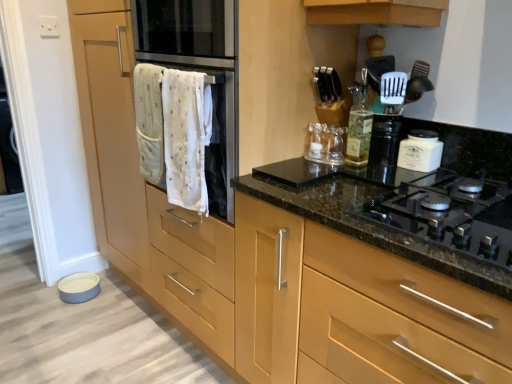
Describe the element at coordinates (355, 309) in the screenshot. I see `matte wood cabinet at center` at that location.

The height and width of the screenshot is (384, 512). Describe the element at coordinates (186, 138) in the screenshot. I see `white cotton bath towel at center, which appears as the 2th bath towel when viewed from the left` at that location.

What is the approximate height of white plastic spatula at upper right?

white plastic spatula at upper right is 7.53 inches in height.

At what (x,y) coordinates should I click in order to perform the action: click on black glass gas stove at center right. Please return your answer as a coordinate pair (x, y). The image size is (512, 384). Looking at the image, I should click on (444, 215).

Locate an element on the screen. oven on the left of translucent glass bottle at upper center is located at coordinates (199, 71).

Considering the positions of point (352, 135) and point (228, 103), is point (352, 135) closer or farther from the camera than point (228, 103)?

Clearly, point (352, 135) is more distant from the camera than point (228, 103).

Consider the image. Which of these two, translucent glass bottle at upper center or white cloth oven at center, is thinner?

With smaller width is translucent glass bottle at upper center.

Is white cloth oven at center at the back of translucent glass bottle at upper center?

translucent glass bottle at upper center does not have its back to white cloth oven at center.

Is white matte jar at upper right oriented away from white plastic spatula at upper right?

That's not correct — white matte jar at upper right is not looking away from white plastic spatula at upper right.

Consider the image. How many degrees apart are the facing directions of white matte jar at upper right and white plastic spatula at upper right?

35.3 degrees.

Considering the relative sizes of white matte jar at upper right and white plastic spatula at upper right in the image provided, is white matte jar at upper right taller than white plastic spatula at upper right?

In fact, white matte jar at upper right may be shorter than white plastic spatula at upper right.

Identify the location of appliance above the white matte jar at upper right (from the image's perspective). (388, 119).

Considering the relative sizes of matte wood cabinet at center and white quilted towel at center, the second bath towel when ordered from right to left, in the image provided, is matte wood cabinet at center wider than white quilted towel at center, the second bath towel when ordered from right to left,?

Indeed, matte wood cabinet at center has a greater width compared to white quilted towel at center, the second bath towel when ordered from right to left.

What's the angular difference between matte wood cabinet at center and white quilted towel at center, which is counted as the first bath towel, starting from the left,'s facing directions?

0.413 degrees.

Looking at this image, considering the relative sizes of matte wood cabinet at center and white quilted towel at center, which is counted as the first bath towel, starting from the left, in the image provided, is matte wood cabinet at center taller than white quilted towel at center, which is counted as the first bath towel, starting from the left,?

Indeed, matte wood cabinet at center has a greater height compared to white quilted towel at center, which is counted as the first bath towel, starting from the left.

Is matte wood cabinet at center oriented towards white quilted towel at center, which is counted as the first bath towel, starting from the left?

No, matte wood cabinet at center is not oriented towards white quilted towel at center, which is counted as the first bath towel, starting from the left.

Is white plastic spatula at upper right taller or shorter than matte wood cabinet at center?

Considering their sizes, white plastic spatula at upper right has less height than matte wood cabinet at center.

Visually, is white plastic spatula at upper right positioned to the left or to the right of matte wood cabinet at center?

In the image, white plastic spatula at upper right appears on the right side of matte wood cabinet at center.

From the picture: From a real-world perspective, who is located higher, white plastic spatula at upper right or matte wood cabinet at center?

white plastic spatula at upper right.

Would you say matte wood cabinet at center is part of white matte jar at upper right's contents?

Definitely not — matte wood cabinet at center is not inside white matte jar at upper right.

Is white matte jar at upper right far away from matte wood cabinet at center?

No, white matte jar at upper right is in close proximity to matte wood cabinet at center.

Which of these two, white matte jar at upper right or matte wood cabinet at center, is wider?

With larger width is matte wood cabinet at center.

Is white matte jar at upper right bigger or smaller than matte wood cabinet at center?

Considering their sizes, white matte jar at upper right takes up less space than matte wood cabinet at center.

From the picture: From the image's perspective, relative to translucent glass bottle at upper center, is white cloth oven at center above or below?

Clearly, from the image's perspective, white cloth oven at center is above translucent glass bottle at upper center.

Is white cloth oven at center spatially inside translucent glass bottle at upper center, or outside of it?

white cloth oven at center is not inside translucent glass bottle at upper center, it's outside.

Is white cloth oven at center turned away from translucent glass bottle at upper center?

No, white cloth oven at center's orientation is not away from translucent glass bottle at upper center.

Does point (337, 303) come closer to viewer compared to point (169, 182)?

Yes, it is.

Is the depth of matte wood cabinet at center greater than that of white cotton bath towel at center, which appears as the 2th bath towel when viewed from the left?

No.

Can you confirm if matte wood cabinet at center is bigger than white cotton bath towel at center, the 1th bath towel when ordered from right to left?

Yes.

Locate an element on the screen. bottle that appears behind the white cloth oven at center is located at coordinates (358, 127).

The height and width of the screenshot is (384, 512). What are the coordinates of `appliance to the left of white matte jar at upper right` in the screenshot? It's located at (388, 119).

Looking at the image, which one is located closer to black glass gas stove at center right, matte wood cabinet at center or white quilted towel at center, which is counted as the first bath towel, starting from the left?

Based on the image, matte wood cabinet at center appears to be nearer to black glass gas stove at center right.

Looking at the image, which one is located closer to translucent glass bottle at upper center, white cotton bath towel at center, which appears as the 2th bath towel when viewed from the left, or white cloth oven at center?

Based on the image, white cloth oven at center appears to be nearer to translucent glass bottle at upper center.

When comparing their distances from black glass gas stove at center right, does white cloth oven at center or matte wood cabinet at center seem closer?

matte wood cabinet at center is closer to black glass gas stove at center right.

Considering their positions, is black glass gas stove at center right positioned closer to white cloth oven at center than white matte jar at upper right?

Based on the image, black glass gas stove at center right appears to be nearer to white cloth oven at center.

Looking at the image, which one is located further to white matte jar at upper right, white cloth oven at center or translucent glass bottle at upper center?

white cloth oven at center is further to white matte jar at upper right.

Which object lies nearer to the anchor point white matte jar at upper right, white cotton bath towel at center, the 1th bath towel when ordered from right to left, or white quilted towel at center, which is counted as the first bath towel, starting from the left?

The object closer to white matte jar at upper right is white cotton bath towel at center, the 1th bath towel when ordered from right to left.

From the image, which object appears to be farther from white quilted towel at center, the second bath towel when ordered from right to left, white matte jar at upper right or white cotton bath towel at center, the 1th bath towel when ordered from right to left?

white matte jar at upper right is positioned further to the anchor white quilted towel at center, the second bath towel when ordered from right to left.

Which object lies further to the anchor point black glass gas stove at center right, white cotton bath towel at center, which appears as the 2th bath towel when viewed from the left, or white matte jar at upper right?

white cotton bath towel at center, which appears as the 2th bath towel when viewed from the left.

Identify the location of oven between white cotton bath towel at center, which appears as the 2th bath towel when viewed from the left, and matte wood cabinet at center, in the horizontal direction. The height and width of the screenshot is (384, 512). (199, 71).

Locate an element on the screen. This screenshot has height=384, width=512. cabinetry between white quilted towel at center, the second bath towel when ordered from right to left, and black glass gas stove at center right from left to right is located at coordinates (355, 309).

At what (x,y) coordinates should I click in order to perform the action: click on bath towel between white quilted towel at center, which is counted as the first bath towel, starting from the left, and white cloth oven at center, in the horizontal direction. Please return your answer as a coordinate pair (x, y). The width and height of the screenshot is (512, 384). Looking at the image, I should click on (186, 138).

The image size is (512, 384). In order to click on gas stove between matte wood cabinet at center and white matte jar at upper right along the z-axis in this screenshot , I will do `click(444, 215)`.